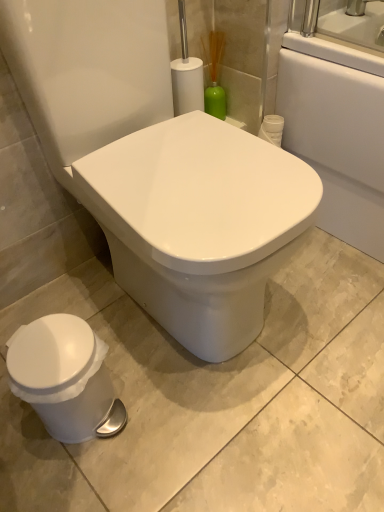
Locate an element on the screen. This screenshot has height=512, width=384. free space in front of white plastic trash can at lower left is located at coordinates pos(75,481).